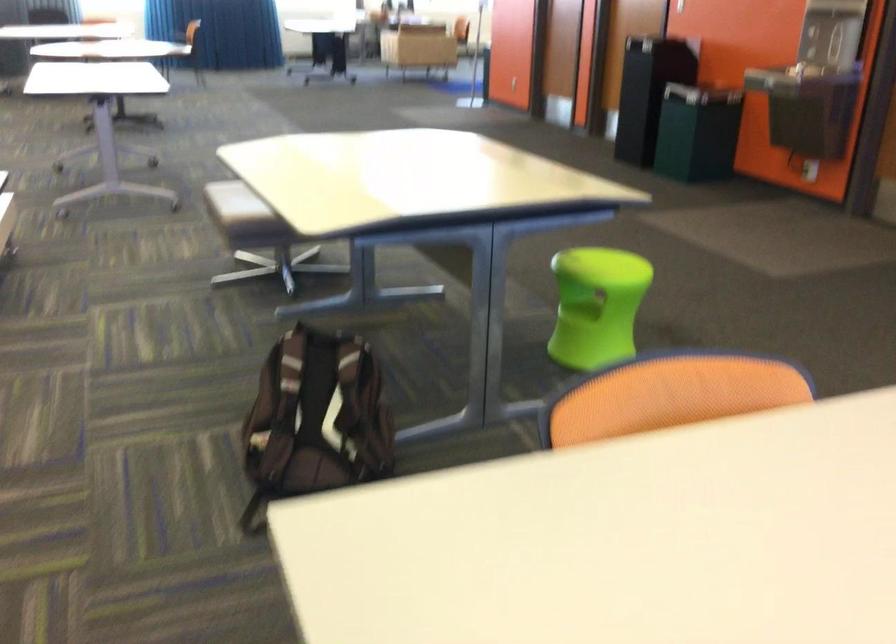
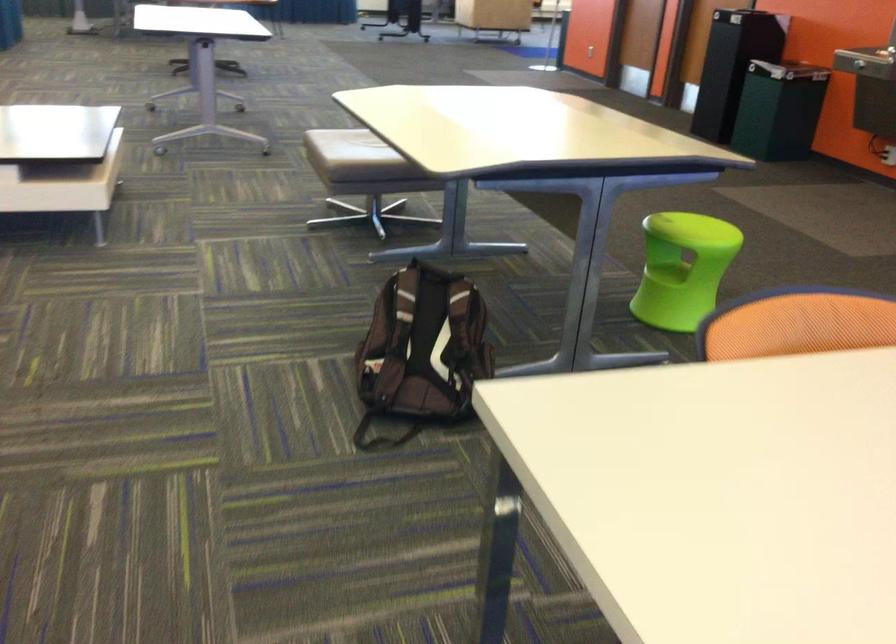
Question: How did the camera likely rotate?

Choices:
 (A) Left
 (B) Right
 (C) Up
 (D) Down

Answer: (D)